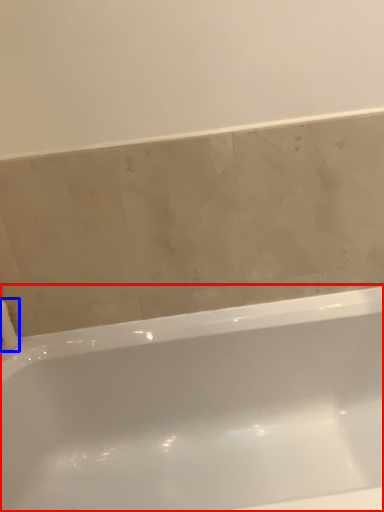
Question: Which object appears closest to the camera in this image, bathtub (highlighted by a red box) or toilet paper (highlighted by a blue box)?

Choices:
 (A) bathtub
 (B) toilet paper

Answer: (A)